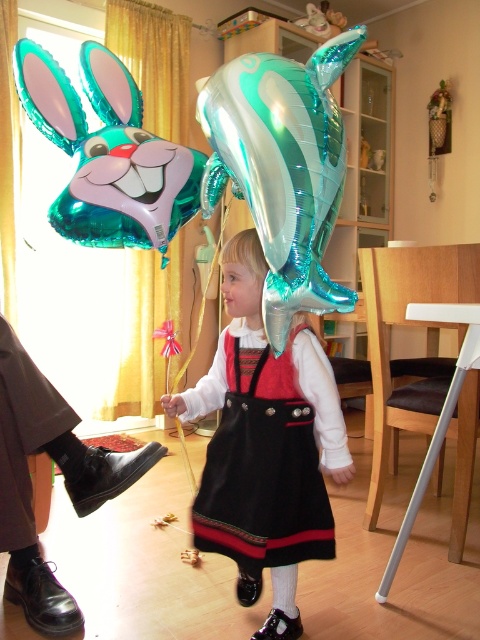
Is teal metallic balloon at upper left closer to the viewer compared to black fabric dress at center?

No, it is not.

Is point (100, 120) closer to viewer compared to point (237, 561)?

No, it is behind (237, 561).

Locate an element on the screen. The image size is (480, 640). teal metallic balloon at upper left is located at coordinates (108, 154).

Between shiny metallic balloon at center and teal metallic dolphin at upper center, which one appears on the left side from the viewer's perspective?

shiny metallic balloon at center is more to the left.

Which is behind, point (242, 420) or point (286, 328)?

Point (242, 420)

Image resolution: width=480 pixels, height=640 pixels. In order to click on shiny metallic balloon at center in this screenshot , I will do `click(265, 445)`.

Consider the image. Does teal metallic dolphin at upper center have a lesser height compared to teal metallic balloon at upper left?

Correct, teal metallic dolphin at upper center is not as tall as teal metallic balloon at upper left.

Does teal metallic dolphin at upper center have a greater height compared to teal metallic balloon at upper left?

No.

Locate an element on the screen. This screenshot has width=480, height=640. teal metallic dolphin at upper center is located at coordinates (283, 168).